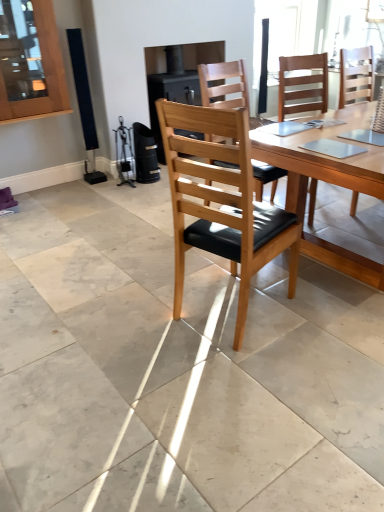
Find the location of a particular element. The height and width of the screenshot is (512, 384). vacant area that is in front of wooden chair with black cushion at center, the first chair viewed from the front is located at coordinates (245, 371).